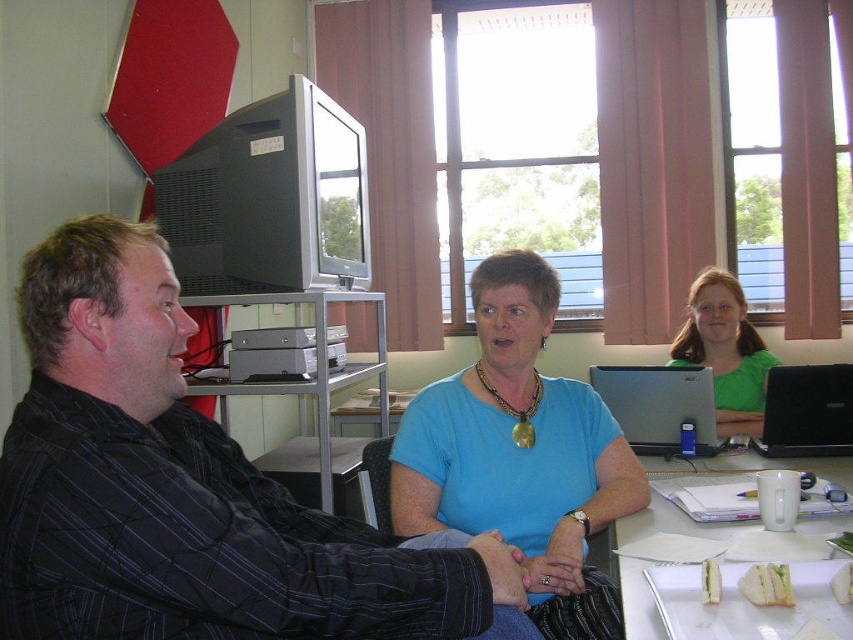
Can you confirm if black matte monitor at upper left is shorter than black plastic laptop at center right?

No, black matte monitor at upper left is not shorter than black plastic laptop at center right.

Does black matte monitor at upper left have a larger size compared to black plastic laptop at center right?

Indeed, black matte monitor at upper left has a larger size compared to black plastic laptop at center right.

Is point (173, 209) in front of point (764, 396)?

That is True.

Where is `black matte monitor at upper left`? black matte monitor at upper left is located at coordinates (270, 198).

Measure the distance between point [300,538] and camera.

Point [300,538] and camera are 1.23 meters apart.

Does striped cotton shirt at center have a lesser width compared to silver metallic laptop at center?

Incorrect, striped cotton shirt at center's width is not less than silver metallic laptop at center's.

Between point (161, 460) and point (663, 433), which one is positioned behind?

The point (663, 433) is more distant.

Where is `striped cotton shirt at center`? The image size is (853, 640). striped cotton shirt at center is located at coordinates (187, 490).

Is point (257, 294) positioned in front of point (816, 396)?

Yes.

You are a GUI agent. You are given a task and a screenshot of the screen. Output one action in this format:
    pyautogui.click(x=<x>, y=<y>)
    Task: Click on the metallic gray table at center
    Image resolution: width=853 pixels, height=640 pixels.
    Given the screenshot: What is the action you would take?
    pyautogui.click(x=316, y=365)

At what (x,y) coordinates should I click in order to perform the action: click on metallic gray table at center. Please return your answer as a coordinate pair (x, y). The width and height of the screenshot is (853, 640). Looking at the image, I should click on (316, 365).

This screenshot has height=640, width=853. In order to click on metallic gray table at center in this screenshot , I will do (316, 365).